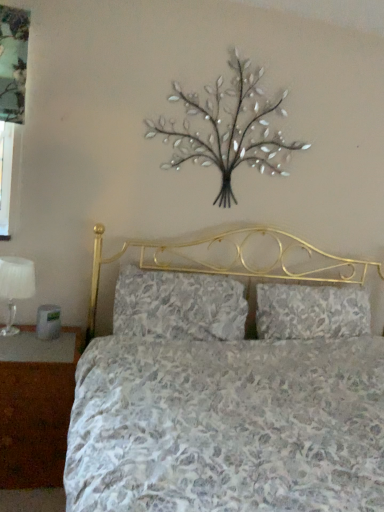
Question: Looking at their shapes, would you say floral fabric pillow at center, the 1th pillow viewed from the right, is wider or thinner than metallic silver tree at upper center?

Choices:
 (A) thin
 (B) wide

Answer: (B)

Question: From the image's perspective, relative to metallic silver tree at upper center, is floral fabric pillow at center, placed as the second pillow when sorted from left to right, above or below?

Choices:
 (A) above
 (B) below

Answer: (B)

Question: Which of these objects is positioned closest to the metallic gray alarm clock at left?

Choices:
 (A) brown wood nightstand at lower left
 (B) metallic silver tree at upper center
 (C) floral fabric pillow at center, placed as the second pillow when sorted from left to right
 (D) white fabric lampshade at left
 (E) floral fabric pillow at center, which is counted as the first pillow, starting from the left

Answer: (D)

Question: Estimate the real-world distances between objects in this image. Which object is farther from the floral fabric pillow at center, the 1th pillow viewed from the right?

Choices:
 (A) metallic gray alarm clock at left
 (B) white fabric lampshade at left
 (C) floral fabric pillow at center, the second pillow from the right
 (D) brown wood nightstand at lower left
 (E) metallic silver tree at upper center

Answer: (B)